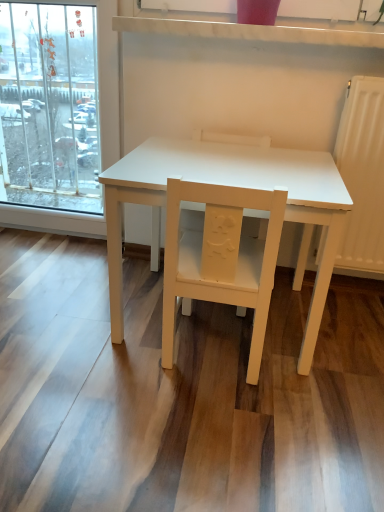
Question: Considering the relative positions of matte yellow chair at center, arranged as the second chair when viewed from the back, and white matte chair at center, which appears as the 2th chair when viewed from the front, in the image provided, is matte yellow chair at center, arranged as the second chair when viewed from the back, in front of white matte chair at center, which appears as the 2th chair when viewed from the front,?

Choices:
 (A) no
 (B) yes

Answer: (B)

Question: From the image's perspective, is matte yellow chair at center, the 1th chair positioned from the front, on white matte chair at center, which appears as the 2th chair when viewed from the front?

Choices:
 (A) yes
 (B) no

Answer: (B)

Question: Is matte yellow chair at center, the 1th chair positioned from the front, directly adjacent to white matte chair at center, the 1th chair viewed from the back?

Choices:
 (A) no
 (B) yes

Answer: (A)

Question: Does matte yellow chair at center, the 1th chair positioned from the front, have a larger size compared to white matte chair at center, the 1th chair viewed from the back?

Choices:
 (A) no
 (B) yes

Answer: (A)

Question: Considering the relative sizes of matte yellow chair at center, arranged as the second chair when viewed from the back, and white matte chair at center, the 1th chair viewed from the back, in the image provided, is matte yellow chair at center, arranged as the second chair when viewed from the back, taller than white matte chair at center, the 1th chair viewed from the back,?

Choices:
 (A) yes
 (B) no

Answer: (B)

Question: From a real-world perspective, is matte yellow chair at center, the 1th chair positioned from the front, above or below white matte chair at center, the 1th chair viewed from the back?

Choices:
 (A) below
 (B) above

Answer: (B)

Question: Is matte yellow chair at center, the 1th chair positioned from the front, spatially inside white matte chair at center, which appears as the 2th chair when viewed from the front, or outside of it?

Choices:
 (A) outside
 (B) inside

Answer: (A)

Question: In the image, is matte yellow chair at center, the 1th chair positioned from the front, positioned in front of or behind white matte chair at center, the 1th chair viewed from the back?

Choices:
 (A) front
 (B) behind

Answer: (A)

Question: Considering the positions of point (233, 247) and point (213, 141), is point (233, 247) closer or farther from the camera than point (213, 141)?

Choices:
 (A) farther
 (B) closer

Answer: (B)

Question: From the image's perspective, is white matte table at center located above or below white matte chair at center, which appears as the 2th chair when viewed from the front?

Choices:
 (A) above
 (B) below

Answer: (B)

Question: Visually, is white matte table at center positioned to the left or to the right of white matte chair at center, which appears as the 2th chair when viewed from the front?

Choices:
 (A) right
 (B) left

Answer: (A)

Question: From their relative heights in the image, would you say white matte table at center is taller or shorter than white matte chair at center, which appears as the 2th chair when viewed from the front?

Choices:
 (A) tall
 (B) short

Answer: (B)

Question: Looking at the image, does white matte table at center seem bigger or smaller compared to white matte chair at center, which appears as the 2th chair when viewed from the front?

Choices:
 (A) big
 (B) small

Answer: (A)

Question: Looking at their shapes, would you say white matte chair at center, the 1th chair viewed from the back, is wider or thinner than matte yellow chair at center, arranged as the second chair when viewed from the back?

Choices:
 (A) wide
 (B) thin

Answer: (B)

Question: From the image's perspective, is white matte chair at center, which appears as the 2th chair when viewed from the front, positioned above or below matte yellow chair at center, the 1th chair positioned from the front?

Choices:
 (A) below
 (B) above

Answer: (B)